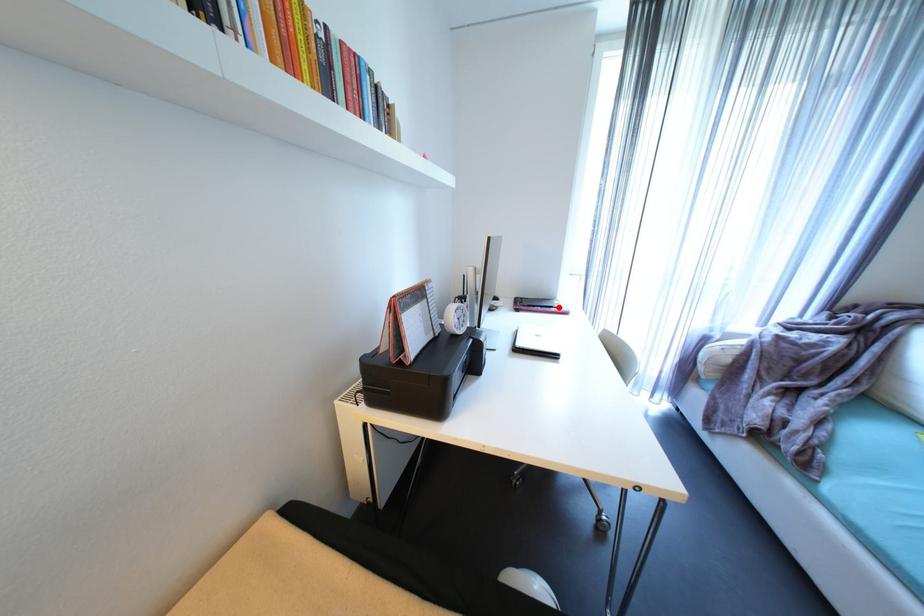
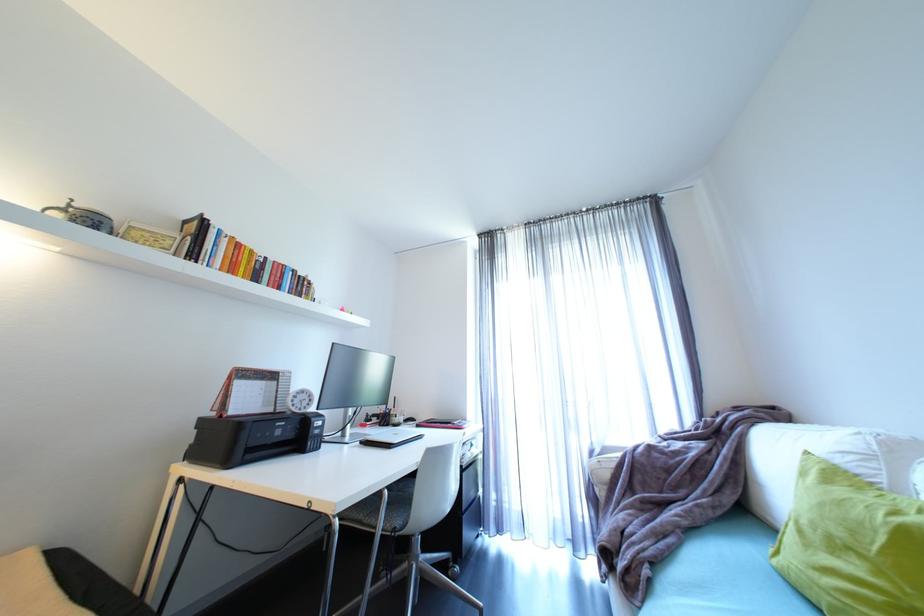
Where in the second image is the point corresponding to the highlighted location from the first image?

(457, 424)